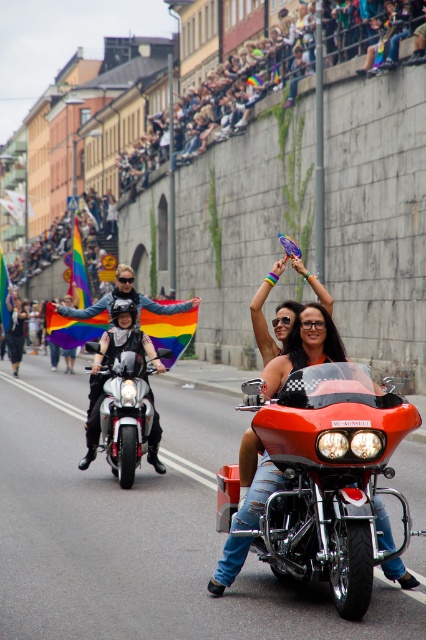
Question: From the image, what is the correct spatial relationship of shiny red motorcycle at center in relation to shiny silver motorcycle at center?

Choices:
 (A) left
 (B) right

Answer: (B)

Question: Does shiny red motorcycle at center have a greater width compared to shiny silver motorcycle at center?

Choices:
 (A) no
 (B) yes

Answer: (B)

Question: Which object is closer to the camera taking this photo?

Choices:
 (A) shiny red motorcycle at center
 (B) shiny silver motorcycle at center

Answer: (A)

Question: Which point appears farthest from the camera in this image?

Choices:
 (A) [149, 417]
 (B) [385, 381]
 (C) [143, 355]

Answer: (C)

Question: Can you confirm if shiny red motorcycle at center is positioned above shiny silver motorcycle at center?

Choices:
 (A) no
 (B) yes

Answer: (A)

Question: Considering the real-world distances, which object is closest to the shiny chrome motorcycle at center?

Choices:
 (A) shiny silver motorcycle at center
 (B) shiny red motorcycle at center

Answer: (A)